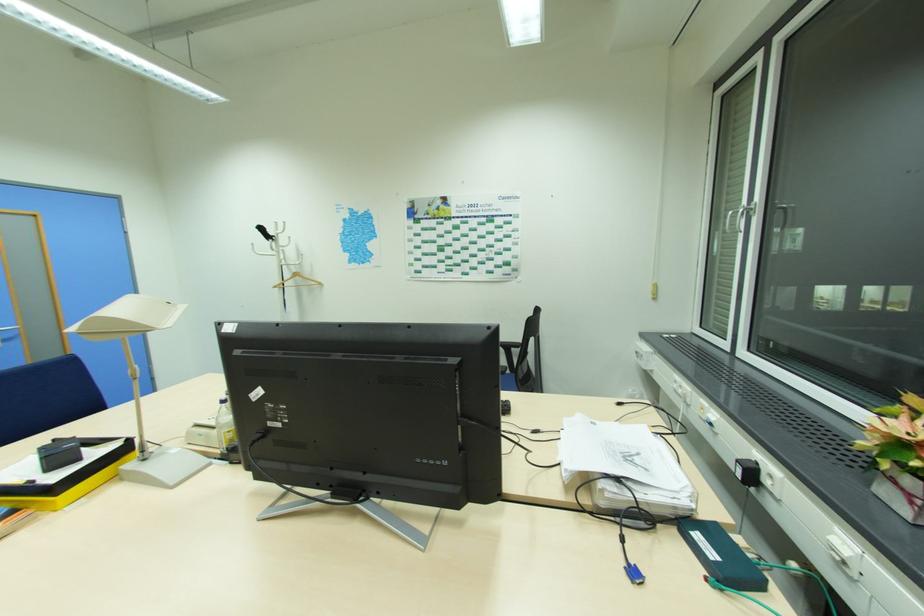
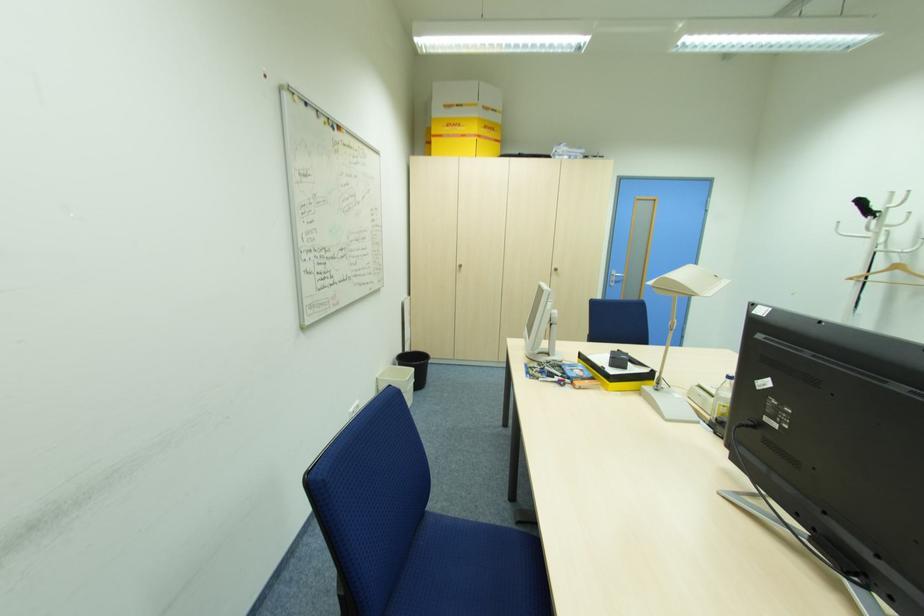
Question: The images are taken continuously from a first-person perspective. In which direction is your viewpoint rotating?

Choices:
 (A) Left
 (B) Right
 (C) Up
 (D) Down

Answer: (A)